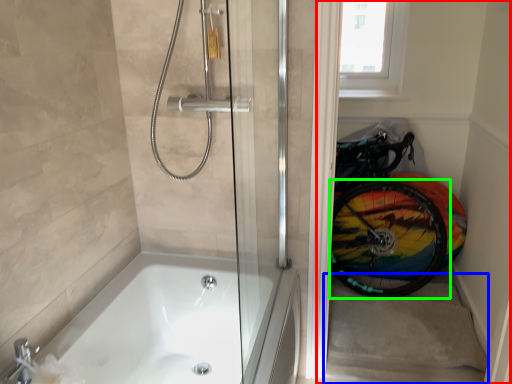
Question: Which object is positioned farthest from glass door (highlighted by a red box)? Select from stairwell (highlighted by a blue box) and bicycle wheel (highlighted by a green box).

Choices:
 (A) stairwell
 (B) bicycle wheel

Answer: (A)